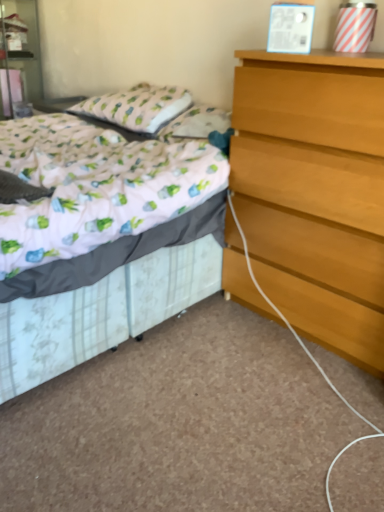
Question: From a real-world perspective, is light brown wooden chest of drawers at right above or below matte white nightstand at upper left?

Choices:
 (A) above
 (B) below

Answer: (B)

Question: Visually, is light brown wooden chest of drawers at right positioned to the left or to the right of matte white nightstand at upper left?

Choices:
 (A) right
 (B) left

Answer: (A)

Question: Which object is positioned closest to the light brown wooden chest of drawers at right?

Choices:
 (A) patterned fabric pillow at upper left
 (B) white floral fabric bed at center
 (C) matte white nightstand at upper left

Answer: (B)

Question: Estimate the real-world distances between objects in this image. Which object is closer to the matte white nightstand at upper left?

Choices:
 (A) patterned fabric pillow at upper left
 (B) white floral fabric bed at center
 (C) light brown wooden chest of drawers at right

Answer: (A)